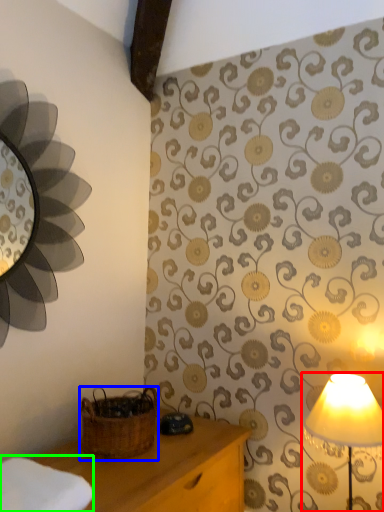
Question: Estimate the real-world distances between objects in this image. Which object is farther from lamp (highlighted by a red box), basket (highlighted by a blue box) or cloth (highlighted by a green box)?

Choices:
 (A) basket
 (B) cloth

Answer: (B)